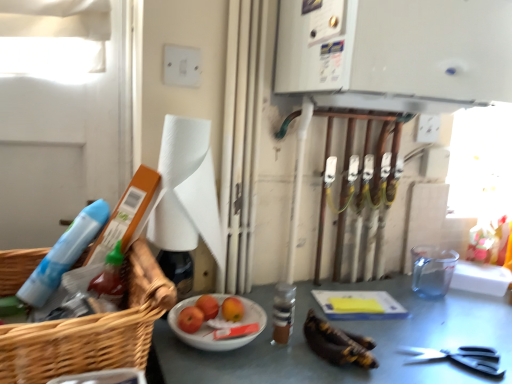
Locate an element on the screen. This screenshot has height=384, width=512. vacant space behind brown glass bottle at center is located at coordinates (292, 300).